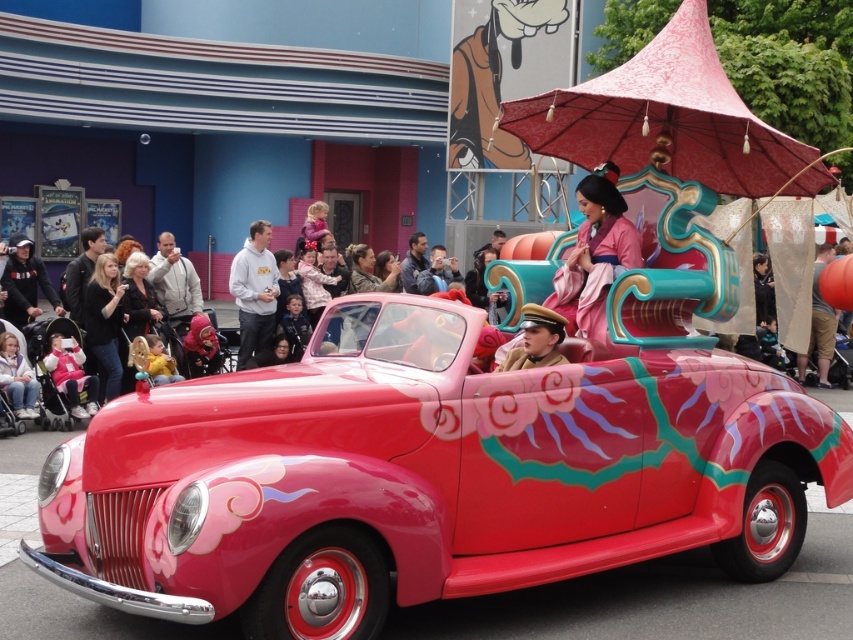
Is pink satin kimono at upper center to the right of gray hoodie at center from the viewer's perspective?

Yes, pink satin kimono at upper center is to the right of gray hoodie at center.

Between point (589, 314) and point (244, 300), which one is positioned behind?

The point (244, 300) is behind.

I want to click on pink satin kimono at upper center, so click(595, 253).

Does glossy metallic car at center have a greater width compared to pink satin kimono at upper center?

Indeed, glossy metallic car at center has a greater width compared to pink satin kimono at upper center.

Is point (526, 476) closer to camera compared to point (589, 291)?

Yes, it is in front of point (589, 291).

This screenshot has height=640, width=853. Identify the location of glossy metallic car at center. (425, 476).

The width and height of the screenshot is (853, 640). Describe the element at coordinates (105, 321) in the screenshot. I see `black leather jacket at left` at that location.

Is black leather jacket at left to the left of white fleece jacket at lower left from the viewer's perspective?

No, black leather jacket at left is not to the left of white fleece jacket at lower left.

Is point (112, 349) positioned after point (3, 356)?

That is True.

This screenshot has height=640, width=853. What are the coordinates of `black leather jacket at left` in the screenshot? It's located at (105, 321).